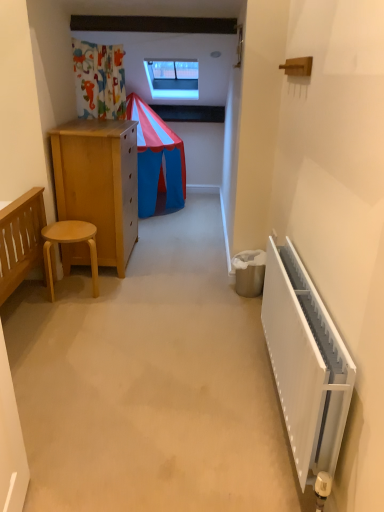
What do you see at coordinates (305, 362) in the screenshot? This screenshot has width=384, height=512. I see `white plastic radiator at right` at bounding box center [305, 362].

This screenshot has width=384, height=512. I want to click on light wood stool at left, so click(x=69, y=242).

Relative to transparent glass window at upper center, is light wood stool at left in front or behind?

Clearly, light wood stool at left is in front of transparent glass window at upper center.

Is light wood stool at left turned away from transparent glass window at upper center?

No, light wood stool at left's orientation is not away from transparent glass window at upper center.

Between light wood stool at left and transparent glass window at upper center, which one appears on the right side from the viewer's perspective?

transparent glass window at upper center.

Which is less distant, [62,234] or [192,70]?

Point [62,234] appears to be closer to the viewer than point [192,70].

Based on their sizes in the image, would you say transparent glass window at upper center is bigger or smaller than light wood stool at left?

In the image, transparent glass window at upper center appears to be larger than light wood stool at left.

In terms of height, does transparent glass window at upper center look taller or shorter compared to light wood stool at left?

Considering their sizes, transparent glass window at upper center has more height than light wood stool at left.

Would you say transparent glass window at upper center is inside or outside light wood stool at left?

transparent glass window at upper center is not enclosed by light wood stool at left.

From a real-world perspective, is transparent glass window at upper center located beneath light wood stool at left?

Incorrect, from a real-world perspective, transparent glass window at upper center is higher than light wood stool at left.

Consider the image. Is light wood stool at left facing towards white plastic radiator at right?

No.

Which is nearer, (71, 231) or (300, 356)?

Clearly, point (71, 231) is more distant from the camera than point (300, 356).

Which object is wider, light wood stool at left or white plastic radiator at right?

light wood stool at left is wider.

This screenshot has height=512, width=384. Identify the location of radiator located in front of the transparent glass window at upper center. (305, 362).

Between white plastic radiator at right and transparent glass window at upper center, which one has more height?

transparent glass window at upper center is taller.

Consider the image. Who is more distant, white plastic radiator at right or transparent glass window at upper center?

Positioned behind is transparent glass window at upper center.

From a real-world perspective, is white plastic radiator at right under transparent glass window at upper center?

Yes, from a real-world perspective, white plastic radiator at right is beneath transparent glass window at upper center.

Does white plastic radiator at right have a smaller size compared to light wood stool at left?

No, white plastic radiator at right is not smaller than light wood stool at left.

Considering the relative sizes of white plastic radiator at right and light wood stool at left in the image provided, is white plastic radiator at right thinner than light wood stool at left?

Indeed, white plastic radiator at right has a lesser width compared to light wood stool at left.

The height and width of the screenshot is (512, 384). Identify the location of stool above the white plastic radiator at right (from the image's perspective). (69, 242).

How many degrees apart are the facing directions of white plastic radiator at right and light wood stool at left?

They differ by 99.2 degrees in their facing directions.

How different are the orientations of transparent glass window at upper center and white plastic radiator at right in degrees?

The facing directions of transparent glass window at upper center and white plastic radiator at right are 90 degrees apart.

Between transparent glass window at upper center and white plastic radiator at right, which one has larger size?

transparent glass window at upper center is bigger.

In the scene shown: Is transparent glass window at upper center in front of white plastic radiator at right?

No, transparent glass window at upper center is further to the viewer.

From a real-world perspective, is transparent glass window at upper center positioned under white plastic radiator at right based on gravity?

No.

Locate an element on the screen. The width and height of the screenshot is (384, 512). window above the light wood stool at left (from the image's perspective) is located at coordinates (173, 78).

Image resolution: width=384 pixels, height=512 pixels. Find the location of `window behind the light wood stool at left`. window behind the light wood stool at left is located at coordinates click(173, 78).

Considering their positions, is light wood stool at left positioned closer to transparent glass window at upper center than white plastic radiator at right?

light wood stool at left.

Which object lies further to the anchor point white plastic radiator at right, transparent glass window at upper center or light wood stool at left?

The object further to white plastic radiator at right is transparent glass window at upper center.

Looking at the image, which one is located further to light wood stool at left, white plastic radiator at right or transparent glass window at upper center?

Among the two, transparent glass window at upper center is located further to light wood stool at left.

From the image, which object appears to be nearer to transparent glass window at upper center, white plastic radiator at right or light wood stool at left?

light wood stool at left is positioned closer to the anchor transparent glass window at upper center.

When comparing their distances from light wood stool at left, does transparent glass window at upper center or white plastic radiator at right seem further?

transparent glass window at upper center is further to light wood stool at left.

When comparing their distances from white plastic radiator at right, does light wood stool at left or transparent glass window at upper center seem closer?

Based on the image, light wood stool at left appears to be nearer to white plastic radiator at right.

Find the location of `stool between white plastic radiator at right and transparent glass window at upper center in the front-back direction`. stool between white plastic radiator at right and transparent glass window at upper center in the front-back direction is located at coordinates (69, 242).